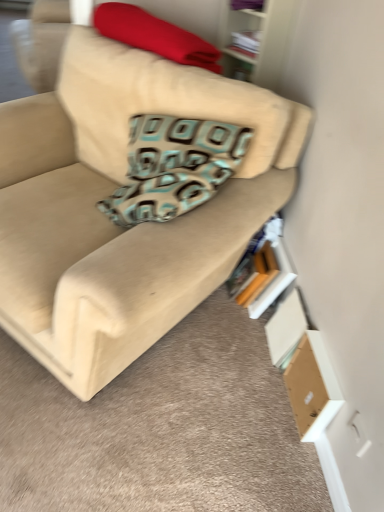
Measure the distance between wooden bookshelf at upper right and camera.

wooden bookshelf at upper right and camera are 5.39 feet apart from each other.

Identify the location of wooden bookshelf at upper right. (257, 41).

I want to click on hardcover book at lower right, the first book from the bottom, so click(x=261, y=271).

In order to click on beige fabric couch at center in this screenshot , I will do pyautogui.click(x=130, y=201).

Which object is thinner, red fabric blanket at upper center or wooden bookshelf at upper right?

With smaller width is wooden bookshelf at upper right.

Does red fabric blanket at upper center turn towards wooden bookshelf at upper right?

No, red fabric blanket at upper center is not facing towards wooden bookshelf at upper right.

What's the angular difference between red fabric blanket at upper center and wooden bookshelf at upper right's facing directions?

A: The facing directions of red fabric blanket at upper center and wooden bookshelf at upper right are 14.9 degrees apart.

In the scene shown: How distant is red fabric blanket at upper center from wooden bookshelf at upper right?

They are 37.57 centimeters apart.

Find the location of `bookshelf above the hardcover book at lower right, the first book from the bottom (from the image's perspective)`. bookshelf above the hardcover book at lower right, the first book from the bottom (from the image's perspective) is located at coordinates (257, 41).

Would you say hardcover book at lower right, the first book from the bottom, is to the left or to the right of wooden bookshelf at upper right in the picture?

Clearly, hardcover book at lower right, the first book from the bottom, is on the right of wooden bookshelf at upper right in the image.

Considering the sizes of hardcover book at lower right, the first book from the bottom, and wooden bookshelf at upper right in the image, is hardcover book at lower right, the first book from the bottom, taller or shorter than wooden bookshelf at upper right?

Considering their sizes, hardcover book at lower right, the first book from the bottom, has less height than wooden bookshelf at upper right.

Based on the photo, from a real-world perspective, is hardcover book at lower right, positioned as the 2th book in top-to-bottom order, positioned over wooden bookshelf at upper right based on gravity?

No.

Are beige fabric couch at center and hardcover book at lower right, the first book from the bottom, beside each other?

No, beige fabric couch at center is not with hardcover book at lower right, the first book from the bottom.

Which is behind, point (269, 208) or point (275, 241)?

Point (275, 241)

Considering the relative sizes of beige fabric couch at center and hardcover book at lower right, positioned as the 2th book in top-to-bottom order, in the image provided, is beige fabric couch at center taller than hardcover book at lower right, positioned as the 2th book in top-to-bottom order,?

Yes, beige fabric couch at center is taller than hardcover book at lower right, positioned as the 2th book in top-to-bottom order.

Does beige fabric couch at center turn towards hardcover book at lower right, positioned as the 2th book in top-to-bottom order?

No, beige fabric couch at center is not turned towards hardcover book at lower right, positioned as the 2th book in top-to-bottom order.

From the image's perspective, relative to brown cardboard box at lower right, is beige fabric couch at center above or below?

From the image's perspective, beige fabric couch at center appears above brown cardboard box at lower right.

Can you confirm if beige fabric couch at center is wider than brown cardboard box at lower right?

Indeed, beige fabric couch at center has a greater width compared to brown cardboard box at lower right.

Does beige fabric couch at center have a lesser height compared to brown cardboard box at lower right?

No.

How many degrees apart are the facing directions of beige fabric couch at center and brown cardboard box at lower right?

45.8 degrees separate the facing orientations of beige fabric couch at center and brown cardboard box at lower right.

Considering the points (259, 35) and (175, 42), which point is behind, point (259, 35) or point (175, 42)?

The point (259, 35) is farther from the camera.

Where is `blanket located above the white paper book at upper center, arranged as the 2th book when ordered from the bottom (from a real-world perspective)`? The height and width of the screenshot is (512, 384). blanket located above the white paper book at upper center, arranged as the 2th book when ordered from the bottom (from a real-world perspective) is located at coordinates (154, 35).

Consider the image. Do you think white paper book at upper center, the 1th book viewed from the top, is within red fabric blanket at upper center, or outside of it?

white paper book at upper center, the 1th book viewed from the top, is located beyond the bounds of red fabric blanket at upper center.

Is hardcover book at lower right, positioned as the 2th book in top-to-bottom order, at the left side of beige fabric couch at center?

No.

Looking at this image, does hardcover book at lower right, the first book from the bottom, have a greater width compared to beige fabric couch at center?

In fact, hardcover book at lower right, the first book from the bottom, might be narrower than beige fabric couch at center.

Does point (250, 300) lie in front of point (171, 155)?

No.

From a real-world perspective, is hardcover book at lower right, positioned as the 2th book in top-to-bottom order, over beige fabric couch at center?

No, from a real-world perspective, hardcover book at lower right, positioned as the 2th book in top-to-bottom order, is not over beige fabric couch at center

Between red fabric blanket at upper center and white paper book at upper center, the 1th book viewed from the top, which one has less height?

white paper book at upper center, the 1th book viewed from the top.

Would you say white paper book at upper center, the 1th book viewed from the top, is part of red fabric blanket at upper center's contents?

No, red fabric blanket at upper center does not contain white paper book at upper center, the 1th book viewed from the top.

Can you confirm if red fabric blanket at upper center is smaller than white paper book at upper center, arranged as the 2th book when ordered from the bottom?

Actually, red fabric blanket at upper center might be larger than white paper book at upper center, arranged as the 2th book when ordered from the bottom.

From the image's perspective, is red fabric blanket at upper center located above white paper book at upper center, arranged as the 2th book when ordered from the bottom?

No, from the image's perspective, red fabric blanket at upper center is not on top of white paper book at upper center, arranged as the 2th book when ordered from the bottom.

Image resolution: width=384 pixels, height=512 pixels. Find the location of `bookshelf above the red fabric blanket at upper center (from the image's perspective)`. bookshelf above the red fabric blanket at upper center (from the image's perspective) is located at coordinates (257, 41).

Identify the location of bookshelf that appears on the left of hardcover book at lower right, the first book from the bottom. (257, 41).

Looking at the image, which one is located further to red fabric blanket at upper center, beige fabric couch at center or hardcover book at lower right, the first book from the bottom?

Among the two, hardcover book at lower right, the first book from the bottom, is located further to red fabric blanket at upper center.

Estimate the real-world distances between objects in this image. Which object is closer to hardcover book at lower right, the first book from the bottom, white paper book at upper center, arranged as the 2th book when ordered from the bottom, or beige fabric couch at center?

beige fabric couch at center is closer to hardcover book at lower right, the first book from the bottom.

Considering their positions, is brown cardboard box at lower right positioned closer to beige fabric couch at center than hardcover book at lower right, positioned as the 2th book in top-to-bottom order?

hardcover book at lower right, positioned as the 2th book in top-to-bottom order, is positioned closer to the anchor beige fabric couch at center.

Based on their spatial positions, is wooden bookshelf at upper right or red fabric blanket at upper center closer to white paper book at upper center, arranged as the 2th book when ordered from the bottom?

Based on the image, wooden bookshelf at upper right appears to be nearer to white paper book at upper center, arranged as the 2th book when ordered from the bottom.

Looking at the image, which one is located further to beige fabric couch at center, hardcover book at lower right, the first book from the bottom, or wooden bookshelf at upper right?

The object further to beige fabric couch at center is wooden bookshelf at upper right.

Estimate the real-world distances between objects in this image. Which object is further from white paper book at upper center, arranged as the 2th book when ordered from the bottom, brown cardboard box at lower right or beige fabric couch at center?

brown cardboard box at lower right lies further to white paper book at upper center, arranged as the 2th book when ordered from the bottom, than the other object.

Considering their positions, is wooden bookshelf at upper right positioned closer to hardcover book at lower right, the first book from the bottom, than red fabric blanket at upper center?

Among the two, wooden bookshelf at upper right is located nearer to hardcover book at lower right, the first book from the bottom.

When comparing their distances from white paper book at upper center, the 1th book viewed from the top, does wooden bookshelf at upper right or beige fabric couch at center seem closer?

Based on the image, wooden bookshelf at upper right appears to be nearer to white paper book at upper center, the 1th book viewed from the top.

What are the coordinates of `blanket between white paper book at upper center, arranged as the 2th book when ordered from the bottom, and hardcover book at lower right, positioned as the 2th book in top-to-bottom order, in the vertical direction` in the screenshot? It's located at pos(154,35).

Locate an element on the screen. This screenshot has width=384, height=512. book between red fabric blanket at upper center and brown cardboard box at lower right in the vertical direction is located at coordinates (261, 271).

What are the coordinates of `studio couch between wooden bookshelf at upper right and hardcover book at lower right, positioned as the 2th book in top-to-bottom order, from top to bottom` in the screenshot? It's located at (130, 201).

Find the location of a particular element. blanket between wooden bookshelf at upper right and brown cardboard box at lower right from top to bottom is located at coordinates (154, 35).